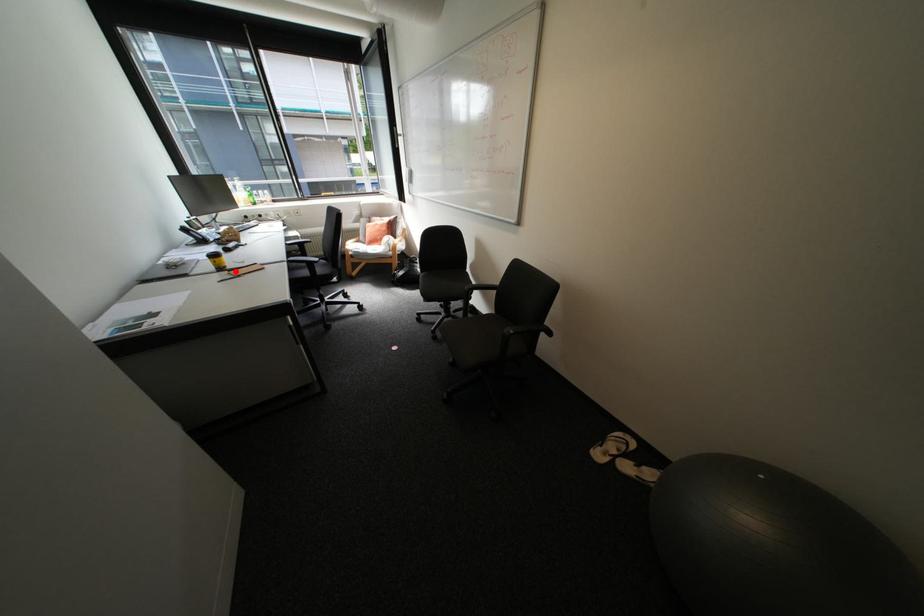
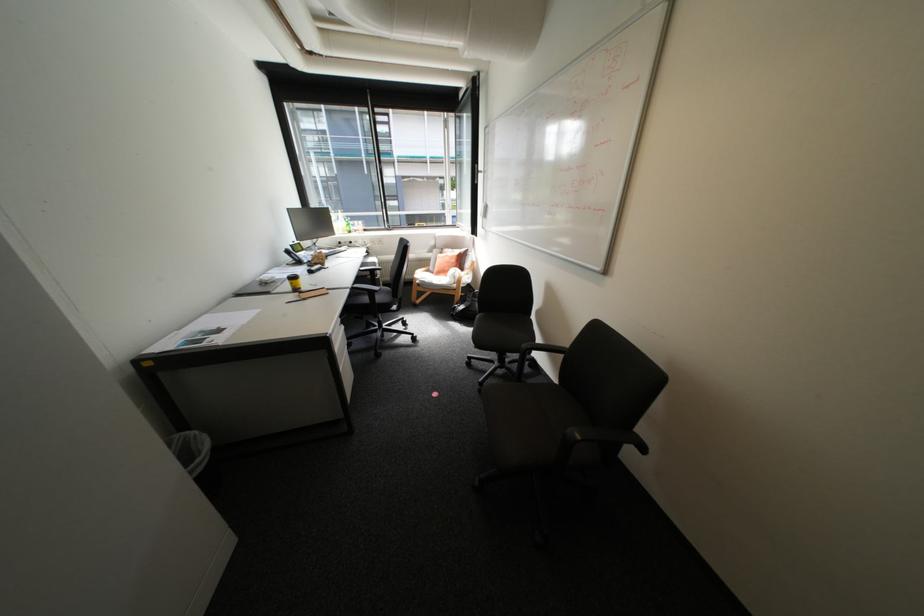
In the second image, find the point that corresponds to the highlighted location in the first image.

(307, 293)